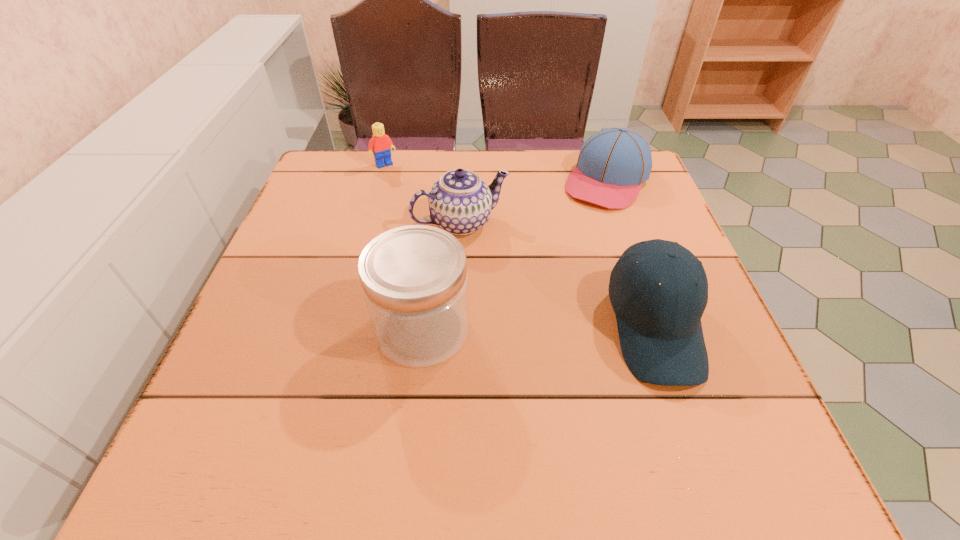
The width and height of the screenshot is (960, 540). I want to click on vacant space located 0.350m at the spout of the chinaware, so click(x=557, y=366).

You are a GUI agent. You are given a task and a screenshot of the screen. Output one action in this format:
    pyautogui.click(x=<x>, y=<y>)
    Task: Click on the free region located 0.090m at the spout of the chinaware
    
    Given the screenshot: What is the action you would take?
    pyautogui.click(x=495, y=268)

Image resolution: width=960 pixels, height=540 pixels. I want to click on vacant space located on the front-facing side of the shorter baseball cap, so click(569, 246).

You are a GUI agent. You are given a task and a screenshot of the screen. Output one action in this format:
    pyautogui.click(x=<x>, y=<y>)
    Task: Click on the free space located on the front-facing side of the shorter baseball cap
    This screenshot has width=960, height=540.
    Given the screenshot: What is the action you would take?
    pyautogui.click(x=557, y=266)

Where is `vacant space located 0.070m on the front-facing side of the shorter baseball cap`? vacant space located 0.070m on the front-facing side of the shorter baseball cap is located at coordinates (583, 224).

Locate an element on the screen. This screenshot has height=540, width=960. Lego situated at the far edge is located at coordinates (381, 143).

I want to click on baseball cap at the far edge, so click(612, 165).

Where is `jar that is at the near edge`? jar that is at the near edge is located at coordinates (414, 278).

Identify the location of baseball cap situated at the near edge. (659, 326).

This screenshot has width=960, height=540. I want to click on object present at the left edge, so click(381, 143).